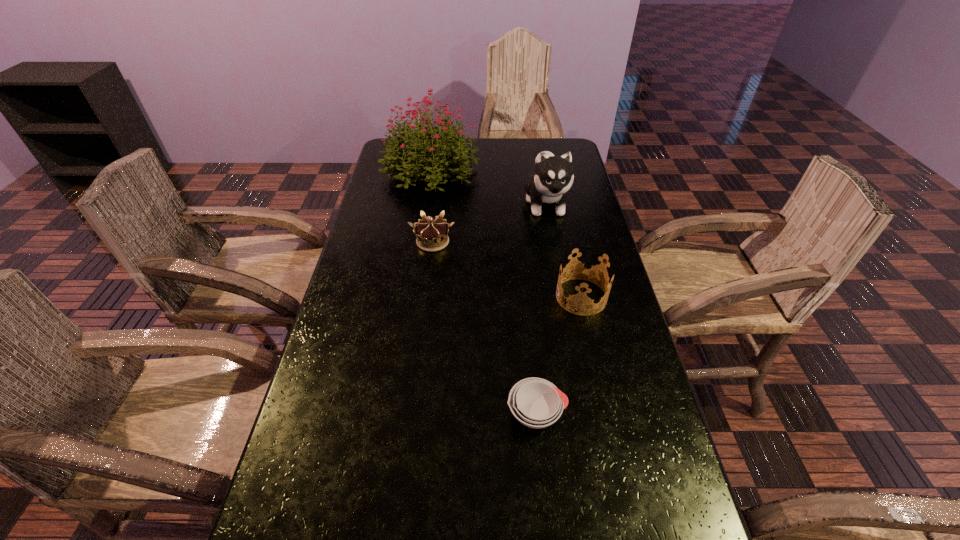
Where is `free space between the puppy and the shortest object`? The width and height of the screenshot is (960, 540). free space between the puppy and the shortest object is located at coordinates (541, 308).

Locate which object is the third closest to the soup bowl. Please provide its 2D coordinates. Your answer should be formatted as a tuple, i.e. [(x, y)], where the tuple contains the x and y coordinates of a point satisfying the conditions above.

[(553, 177)]

Identify which object is located as the third nearest to the fourth shortest object. Please provide its 2D coordinates. Your answer should be formatted as a tuple, i.e. [(x, y)], where the tuple contains the x and y coordinates of a point satisfying the conditions above.

[(579, 298)]

The width and height of the screenshot is (960, 540). In order to click on free region that satisfies the following two spatial constraints: 1. on the front side of the third shortest object; 2. on the left side of the fourth tallest object in this screenshot , I will do `click(426, 297)`.

Locate an element on the screen. vacant space that satisfies the following two spatial constraints: 1. at the face of the third shortest object; 2. on the left side of the fourth shortest object is located at coordinates (564, 297).